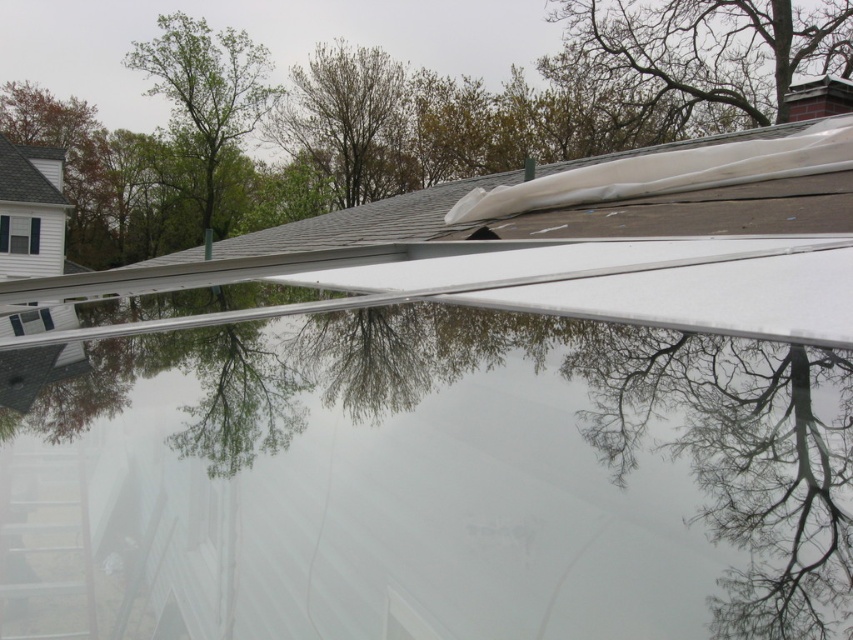
You are standing on the ground looking at the roof with the green leafy tree at upper center and the gray shingles at upper center. Which object is closer to you?

The green leafy tree at upper center is closer to you because it is positioned in front of the gray shingles at upper center.

You are standing on the roof and looking at the construction area. There is a point marked at coordinates [425,481]. What is located at that point?

The point at coordinates [425,481] marks transparent glass water at center.

You are a construction worker standing on the roof and need to reach the bare branches at upper right to secure the tarp. The transparent glass water at center is in your path. Can you safely walk around it without stepping into the water?

The transparent glass water at center is 24.12 meters away from the bare branches at upper right. Since the distance is significant, you can safely walk around the transparent glass water at center to reach the bare branches at upper right without stepping into the water.